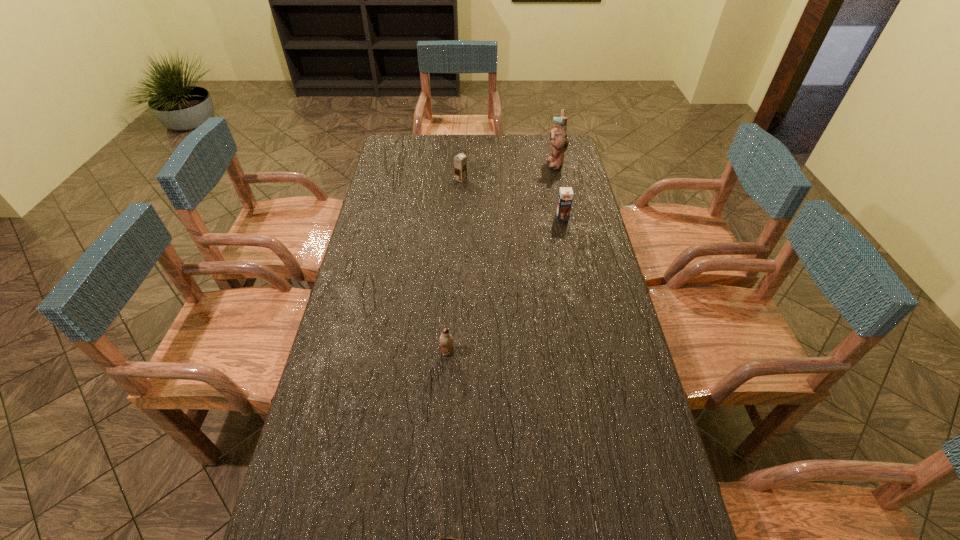
The height and width of the screenshot is (540, 960). What are the coordinates of `free space that is in between the fourth farthest object and the farthest object` in the screenshot? It's located at (501, 258).

At what (x,y) coordinates should I click in order to perform the action: click on vacant area between the nearest chocolate milk and the third farthest object. Please return your answer as a coordinate pair (x, y). Image resolution: width=960 pixels, height=540 pixels. Looking at the image, I should click on (505, 285).

I want to click on vacant space that is in between the fourth nearest object and the second nearest object, so click(454, 266).

Image resolution: width=960 pixels, height=540 pixels. Find the location of `free space between the second nearest object and the rightmost chocolate milk`. free space between the second nearest object and the rightmost chocolate milk is located at coordinates (505, 285).

Find the location of a particular element. The width and height of the screenshot is (960, 540). unoccupied position between the nearest chocolate milk and the rightmost chocolate milk is located at coordinates (505, 285).

Locate an element on the screen. This screenshot has width=960, height=540. free area in between the fourth farthest object and the rightmost chocolate milk is located at coordinates (505, 285).

Identify the location of vacant area between the farthest chocolate milk and the nearest chocolate milk. The width and height of the screenshot is (960, 540). [x=454, y=266].

Find the location of a particular element. The width and height of the screenshot is (960, 540). free area in between the figurine and the rightmost chocolate milk is located at coordinates (559, 190).

Identify which object is located as the nearest to the farthest object. Please provide its 2D coordinates. Your answer should be formatted as a tuple, i.e. [(x, y)], where the tuple contains the x and y coordinates of a point satisfying the conditions above.

[(565, 197)]

Where is `the third closest object to the nearest chocolate milk`? the third closest object to the nearest chocolate milk is located at coordinates coord(460,162).